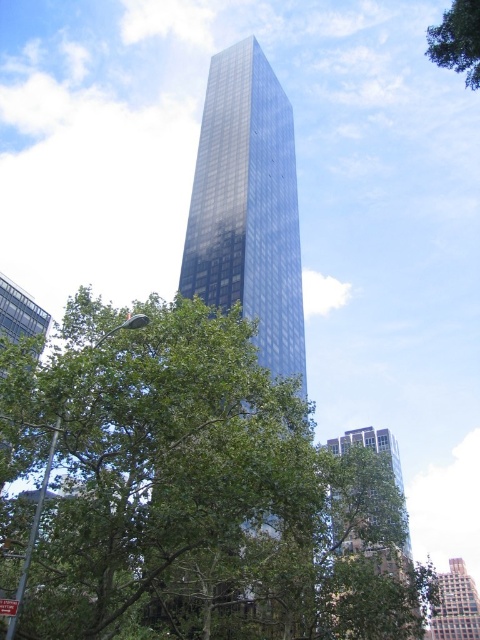
Can you confirm if glossy glass tower at center is thinner than glassy reflective skyscraper at center?

Correct, glossy glass tower at center's width is less than glassy reflective skyscraper at center's.

Identify the location of glossy glass tower at center. This screenshot has height=640, width=480. (248, 205).

What are the coordinates of `glossy glass tower at center` in the screenshot? It's located at (248, 205).

Can you confirm if glassy reflective skyscraper at center is bigger than green leafy tree at upper right?

No.

Is glassy reflective skyscraper at center positioned in front of green leafy tree at upper right?

No, it is behind green leafy tree at upper right.

Where is `glassy reflective skyscraper at center`? glassy reflective skyscraper at center is located at coordinates (396, 490).

At what (x,y) coordinates should I click in order to perform the action: click on glassy reflective skyscraper at center. Please return your answer as a coordinate pair (x, y). Looking at the image, I should click on pos(396,490).

Can you confirm if green leafy tree at center is shorter than glossy glass tower at center?

Yes, green leafy tree at center is shorter than glossy glass tower at center.

Does green leafy tree at center come in front of glossy glass tower at center?

Yes, it is in front of glossy glass tower at center.

Does point (51, 419) come farther from viewer compared to point (238, 244)?

No, it is in front of (238, 244).

The width and height of the screenshot is (480, 640). What are the coordinates of `green leafy tree at center` in the screenshot? It's located at (190, 492).